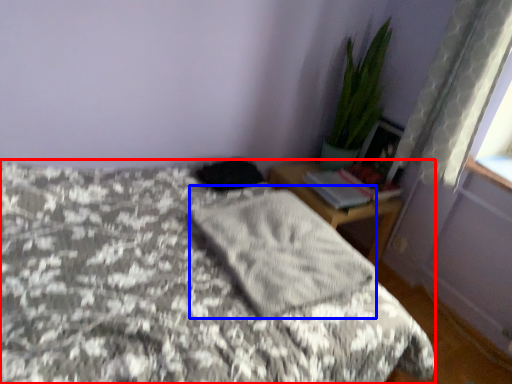
Question: Which object appears closest to the camera in this image, bed (highlighted by a red box) or mattress (highlighted by a blue box)?

Choices:
 (A) bed
 (B) mattress

Answer: (A)